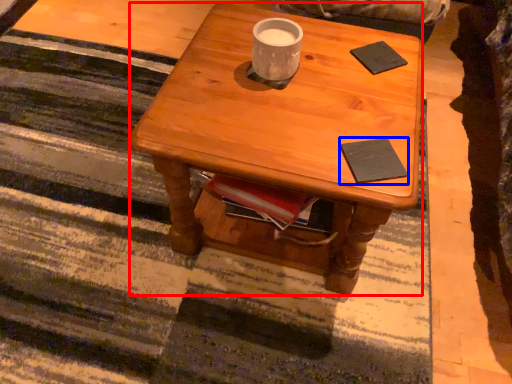
Question: Which object is further to the camera taking this photo, desk (highlighted by a red box) or pad (highlighted by a blue box)?

Choices:
 (A) desk
 (B) pad

Answer: (B)